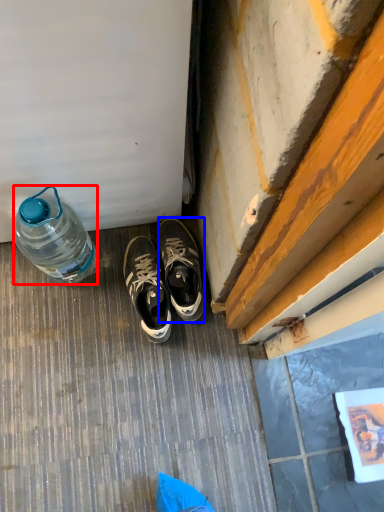
Question: Which of the following is the farthest to the observer, bottle (highlighted by a red box) or sneakers (highlighted by a blue box)?

Choices:
 (A) bottle
 (B) sneakers

Answer: (B)